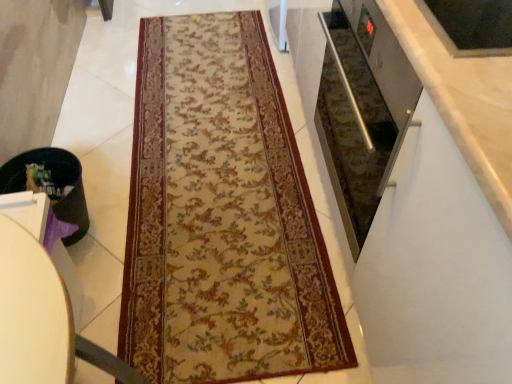
What is the approximate height of beige floral rug at center?

It is 2.41 centimeters.

Describe the element at coordinates (40, 307) in the screenshot. I see `black plastic trash can at lower left` at that location.

Identify the location of black plastic trash can at lower left. The image size is (512, 384). (55, 181).

Considering the relative positions of beige floral rug at center and black plastic trash can at lower left in the image provided, is beige floral rug at center to the right of black plastic trash can at lower left from the viewer's perspective?

Yes.

Does point (217, 302) appear closer or farther from the camera than point (53, 150)?

Point (217, 302) is closer to the camera than point (53, 150).

Can you confirm if beige floral rug at center is shorter than black plastic trash can at lower left?

Indeed, beige floral rug at center has a lesser height compared to black plastic trash can at lower left.

From the image's perspective, is black plastic trash can at lower left under black plastic trash can at lower left?

No, from the image's perspective, black plastic trash can at lower left is not below black plastic trash can at lower left.

Where is `appliance that is above the black plastic trash can at lower left (from the image's perspective)`? The height and width of the screenshot is (384, 512). appliance that is above the black plastic trash can at lower left (from the image's perspective) is located at coordinates (55, 181).

Who is taller, black plastic trash can at lower left or black plastic trash can at lower left?

With more height is black plastic trash can at lower left.

How different are the orientations of black plastic trash can at lower left and black plastic trash can at lower left in degrees?

The angular difference between black plastic trash can at lower left and black plastic trash can at lower left is 0.00271 degrees.

From a real-world perspective, is black plastic trash can at lower left located higher than beige floral rug at center?

Correct, in the physical world, black plastic trash can at lower left is higher than beige floral rug at center.

What are the coordinates of `appliance that is behind the beige floral rug at center` in the screenshot? It's located at (55, 181).

From the picture: Considering the relative sizes of black plastic trash can at lower left and beige floral rug at center in the image provided, is black plastic trash can at lower left shorter than beige floral rug at center?

No, black plastic trash can at lower left is not shorter than beige floral rug at center.

Is black plastic trash can at lower left oriented away from beige floral rug at center?

That's not correct — black plastic trash can at lower left is not looking away from beige floral rug at center.

Is black plastic trash can at lower left positioned before beige floral rug at center?

Yes, it is.

Considering the relative sizes of black plastic trash can at lower left and beige floral rug at center in the image provided, is black plastic trash can at lower left smaller than beige floral rug at center?

Indeed, black plastic trash can at lower left has a smaller size compared to beige floral rug at center.

What's the angular difference between black plastic trash can at lower left and beige floral rug at center's facing directions?

There is a 91.9-degree angle between the facing directions of black plastic trash can at lower left and beige floral rug at center.

What's the angular difference between beige floral rug at center and black plastic trash can at lower left's facing directions?

The angular difference between beige floral rug at center and black plastic trash can at lower left is 91.9 degrees.

Is there a large distance between beige floral rug at center and black plastic trash can at lower left?

Yes, beige floral rug at center and black plastic trash can at lower left are located far from each other.

In the image, is beige floral rug at center positioned in front of or behind black plastic trash can at lower left?

Clearly, beige floral rug at center is behind black plastic trash can at lower left.

Locate an element on the screen. mat to the right of black plastic trash can at lower left is located at coordinates (221, 216).

Locate an element on the screen. Image resolution: width=512 pixels, height=384 pixels. appliance below the black plastic trash can at lower left (from a real-world perspective) is located at coordinates (55, 181).

Does black plastic trash can at lower left contain black plastic trash can at lower left?

Definitely not — black plastic trash can at lower left is not inside black plastic trash can at lower left.

Image resolution: width=512 pixels, height=384 pixels. I want to click on appliance above the beige floral rug at center (from a real-world perspective), so pyautogui.click(x=55, y=181).

Find the location of a particular element. The image size is (512, 384). appliance above the black plastic trash can at lower left (from the image's perspective) is located at coordinates (55, 181).

Which object lies nearer to the anchor point beige floral rug at center, black plastic trash can at lower left or black plastic trash can at lower left?

Among the two, black plastic trash can at lower left is located nearer to beige floral rug at center.

In the scene shown: Estimate the real-world distances between objects in this image. Which object is further from black plastic trash can at lower left, black plastic trash can at lower left or beige floral rug at center?

The object further to black plastic trash can at lower left is beige floral rug at center.

Estimate the real-world distances between objects in this image. Which object is closer to black plastic trash can at lower left, beige floral rug at center or black plastic trash can at lower left?

Answer: Based on the image, black plastic trash can at lower left appears to be nearer to black plastic trash can at lower left.

In the scene shown: When comparing their distances from beige floral rug at center, does black plastic trash can at lower left or black plastic trash can at lower left seem closer?

Among the two, black plastic trash can at lower left is located nearer to beige floral rug at center.

Based on the photo, considering their positions, is black plastic trash can at lower left positioned closer to black plastic trash can at lower left than beige floral rug at center?

beige floral rug at center is closer to black plastic trash can at lower left.

From the image, which object appears to be farther from black plastic trash can at lower left, beige floral rug at center or black plastic trash can at lower left?

Among the two, black plastic trash can at lower left is located further to black plastic trash can at lower left.

This screenshot has width=512, height=384. I want to click on furniture situated between black plastic trash can at lower left and beige floral rug at center from left to right, so click(40, 307).